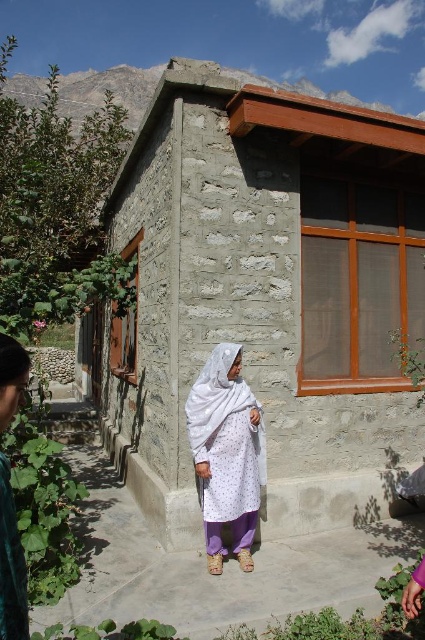
Between stone textured hut at center and white textured dress at center, which one is positioned lower?

white textured dress at center is below.

Does stone textured hut at center lie in front of white textured dress at center?

No, stone textured hut at center is further to the viewer.

Is point (125, 460) behind point (221, 356)?

Yes, point (125, 460) is farther from viewer.

Where is `stone textured hut at center`? The width and height of the screenshot is (425, 640). stone textured hut at center is located at coordinates tap(263, 294).

Can you confirm if stone textured hut at center is shorter than white sheer fabric at center?

No, stone textured hut at center is not shorter than white sheer fabric at center.

Is stone textured hut at center positioned in front of white sheer fabric at center?

No.

Between point (300, 486) and point (5, 380), which one is positioned in front?

Point (5, 380)

You are a GUI agent. You are given a task and a screenshot of the screen. Output one action in this format:
    pyautogui.click(x=<x>, y=<y>)
    Task: Click on the stone textured hut at center
    
    Given the screenshot: What is the action you would take?
    pyautogui.click(x=263, y=294)

Is white textured dress at center below white sheer fabric at center?

Indeed, white textured dress at center is positioned under white sheer fabric at center.

Does point (244, 468) come closer to viewer compared to point (11, 570)?

No, it is behind (11, 570).

This screenshot has height=640, width=425. In order to click on white textured dress at center in this screenshot , I will do `click(226, 452)`.